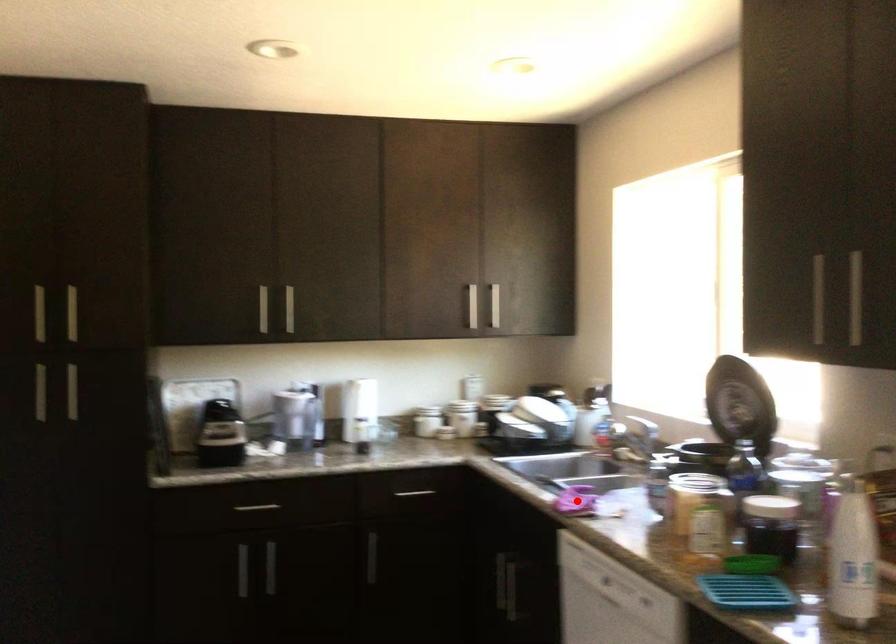
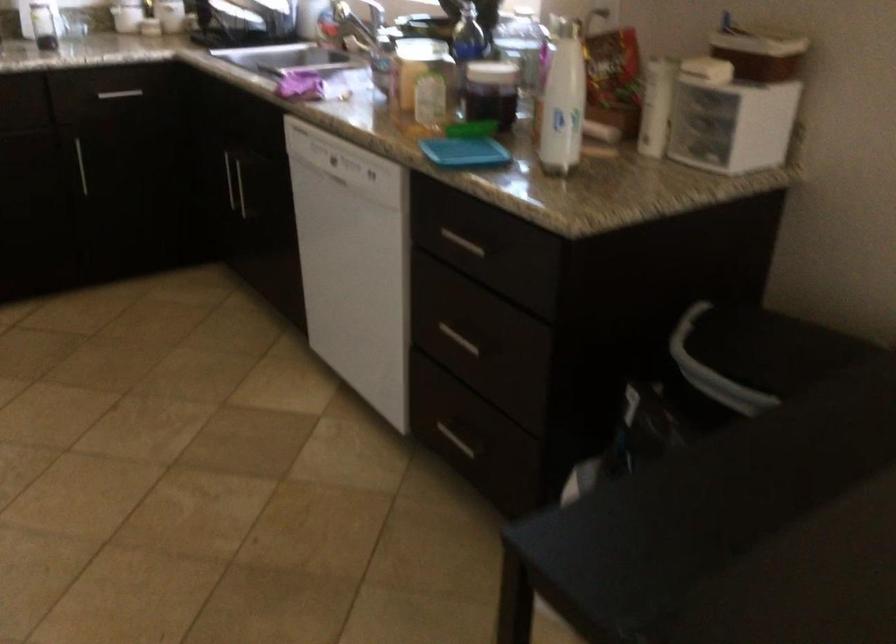
Where in the second image is the point corresponding to the highlighted location from the first image?

(299, 84)